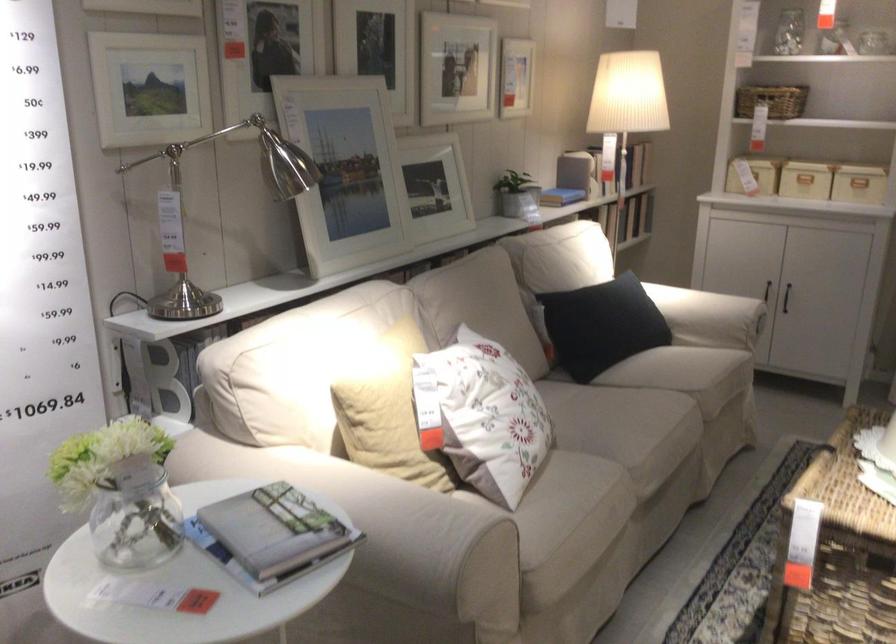
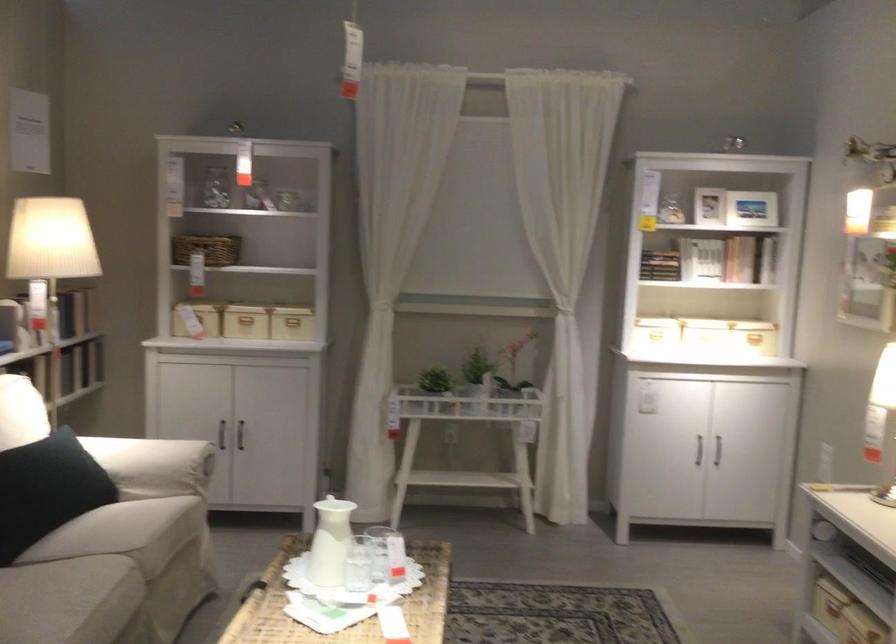
Find the pixel in the second image that matches point (677, 402) in the first image.

(110, 576)